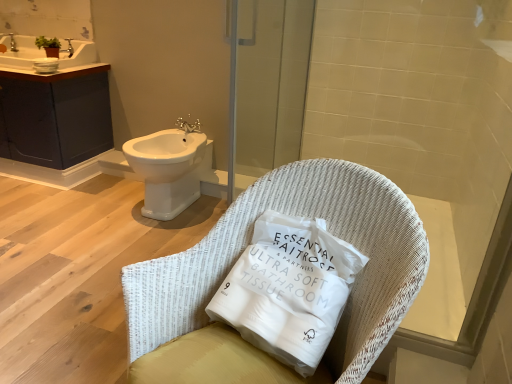
The image size is (512, 384). What do you see at coordinates (55, 117) in the screenshot? I see `dark gray matte cabinet at upper left` at bounding box center [55, 117].

Locate an element on the screen. The height and width of the screenshot is (384, 512). silver metallic faucet at upper center is located at coordinates (188, 125).

Describe the element at coordinates (294, 215) in the screenshot. I see `white wicker chair at center` at that location.

Image resolution: width=512 pixels, height=384 pixels. In order to click on transparent glass screen door at upper center in this screenshot , I will do `click(267, 84)`.

This screenshot has width=512, height=384. What do you see at coordinates (267, 84) in the screenshot?
I see `transparent glass screen door at upper center` at bounding box center [267, 84].

The height and width of the screenshot is (384, 512). Describe the element at coordinates (288, 289) in the screenshot. I see `white woven pillow at center` at that location.

Where is `white woven pillow at center`? The image size is (512, 384). white woven pillow at center is located at coordinates [288, 289].

The width and height of the screenshot is (512, 384). Find the location of `white glossy bidet at left`. white glossy bidet at left is located at coordinates (168, 170).

From the picture: Does white wicker chair at center have a lesser width compared to silver metallic faucet at upper center?

Incorrect, the width of white wicker chair at center is not less than that of silver metallic faucet at upper center.

Is white wicker chair at center not inside silver metallic faucet at upper center?

Yes, white wicker chair at center is not within silver metallic faucet at upper center.

Is white wicker chair at center oriented away from silver metallic faucet at upper center?

No, white wicker chair at center's orientation is not away from silver metallic faucet at upper center.

Which of these two, white wicker chair at center or silver metallic faucet at upper center, is bigger?

white wicker chair at center.

Is point (295, 321) positioned before point (179, 126)?

Yes, it is.

Is white woven pillow at center with silver metallic faucet at upper center?

No, white woven pillow at center is not beside silver metallic faucet at upper center.

Is white woven pillow at center situated inside silver metallic faucet at upper center or outside?

white woven pillow at center is not enclosed by silver metallic faucet at upper center.

Who is more distant, white woven pillow at center or silver metallic faucet at upper center?

silver metallic faucet at upper center.

Is silver metallic faucet at upper center thinner than white woven pillow at center?

Yes, silver metallic faucet at upper center is thinner than white woven pillow at center.

In order to click on pillow on the right of silver metallic faucet at upper center in this screenshot , I will do `click(288, 289)`.

From a real-world perspective, who is located lower, silver metallic faucet at upper center or white woven pillow at center?

In real-world perspective, silver metallic faucet at upper center is lower.

Considering the sizes of objects dark gray matte cabinet at upper left and white wicker chair at center in the image provided, who is wider, dark gray matte cabinet at upper left or white wicker chair at center?

Wider between the two is white wicker chair at center.

I want to click on bathroom cabinet behind the white wicker chair at center, so click(x=55, y=117).

Is the surface of dark gray matte cabinet at upper left in direct contact with white wicker chair at center?

dark gray matte cabinet at upper left is not next to white wicker chair at center, and they're not touching.

Considering the sizes of objects dark gray matte cabinet at upper left and white wicker chair at center in the image provided, who is bigger, dark gray matte cabinet at upper left or white wicker chair at center?

With larger size is dark gray matte cabinet at upper left.

Looking at their sizes, would you say transparent glass screen door at upper center is wider or thinner than dark gray matte cabinet at upper left?

Considering their sizes, transparent glass screen door at upper center looks slimmer than dark gray matte cabinet at upper left.

What's the angular difference between transparent glass screen door at upper center and dark gray matte cabinet at upper left's facing directions?

89.4 degrees.

From a real-world perspective, which object stands above the other?

transparent glass screen door at upper center, from a real-world perspective.

From the image's perspective, is transparent glass screen door at upper center positioned above or below dark gray matte cabinet at upper left?

From the image's perspective, transparent glass screen door at upper center appears below dark gray matte cabinet at upper left.

Considering the positions of objects white wicker chair at center and dark gray matte cabinet at upper left in the image provided, who is in front, white wicker chair at center or dark gray matte cabinet at upper left?

white wicker chair at center is in front.

Is white wicker chair at center surrounding dark gray matte cabinet at upper left?

No, dark gray matte cabinet at upper left is not surrounded by white wicker chair at center.

Considering the positions of points (149, 297) and (102, 105), is point (149, 297) farther from camera compared to point (102, 105)?

That is False.

At what (x,y) coordinates should I click in order to perform the action: click on bidet in front of the dark gray matte cabinet at upper left. Please return your answer as a coordinate pair (x, y). Looking at the image, I should click on (168, 170).

Could you tell me if dark gray matte cabinet at upper left is facing white glossy bidet at left?

No, dark gray matte cabinet at upper left is not aimed at white glossy bidet at left.

Who is smaller, dark gray matte cabinet at upper left or white glossy bidet at left?

white glossy bidet at left.

From the image's perspective, between dark gray matte cabinet at upper left and white glossy bidet at left, which one is located above?

dark gray matte cabinet at upper left.

The image size is (512, 384). In order to click on tap on the left of white wicker chair at center in this screenshot , I will do `click(188, 125)`.

Identify the location of pillow located below the silver metallic faucet at upper center (from the image's perspective). This screenshot has height=384, width=512. click(x=288, y=289).

Looking at this image, when comparing their distances from dark gray matte cabinet at upper left, does white ceramic sink at upper left or white glossy bidet at left seem further?

white glossy bidet at left is further to dark gray matte cabinet at upper left.

From the image, which object appears to be nearer to white woven pillow at center, white wicker chair at center or white glossy bidet at left?

white wicker chair at center lies closer to white woven pillow at center than the other object.

Looking at the image, which one is located further to white glossy bidet at left, dark gray matte cabinet at upper left or white woven pillow at center?

Among the two, white woven pillow at center is located further to white glossy bidet at left.

Which object lies nearer to the anchor point white glossy bidet at left, transparent glass screen door at upper center or silver metallic faucet at upper center?

Based on the image, silver metallic faucet at upper center appears to be nearer to white glossy bidet at left.

Considering their positions, is white ceramic sink at upper left positioned closer to white wicker chair at center than silver metallic faucet at upper center?

The object closer to white wicker chair at center is silver metallic faucet at upper center.

From the picture: Based on their spatial positions, is dark gray matte cabinet at upper left or white glossy bidet at left further from transparent glass screen door at upper center?

A: Among the two, dark gray matte cabinet at upper left is located further to transparent glass screen door at upper center.

Estimate the real-world distances between objects in this image. Which object is further from white glossy bidet at left, white ceramic sink at upper left or dark gray matte cabinet at upper left?

white ceramic sink at upper left is further to white glossy bidet at left.

Estimate the real-world distances between objects in this image. Which object is closer to dark gray matte cabinet at upper left, white woven pillow at center or silver metallic faucet at upper center?

Based on the image, silver metallic faucet at upper center appears to be nearer to dark gray matte cabinet at upper left.

At what (x,y) coordinates should I click in order to perform the action: click on bidet positioned between white wicker chair at center and white ceramic sink at upper left from near to far. Please return your answer as a coordinate pair (x, y). This screenshot has width=512, height=384. Looking at the image, I should click on (168, 170).

What are the coordinates of `tap located between white ceramic sink at upper left and transparent glass screen door at upper center in the left-right direction` in the screenshot? It's located at (188, 125).

I want to click on bidet between dark gray matte cabinet at upper left and silver metallic faucet at upper center in the horizontal direction, so point(168,170).

Locate an element on the screen. bathroom cabinet between white woven pillow at center and silver metallic faucet at upper center along the z-axis is located at coordinates (55, 117).